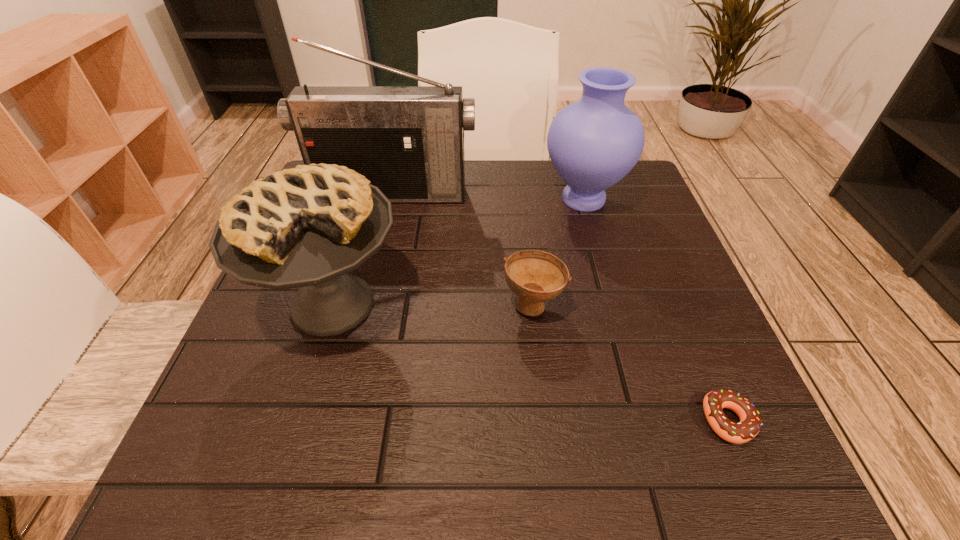
What are the coordinates of `object located in the near right corner section of the desktop` in the screenshot? It's located at (750, 423).

This screenshot has height=540, width=960. In the image, there is a desktop. What are the coordinates of `vacant space at the left edge` in the screenshot? It's located at (290, 420).

In the image, there is a desktop. Where is `vacant space at the right edge`? vacant space at the right edge is located at coordinates (651, 308).

In the image, there is a desktop. Find the location of `vacant space at the near right corner`. vacant space at the near right corner is located at coordinates (708, 463).

Image resolution: width=960 pixels, height=540 pixels. Identify the location of free space that is in between the doughnut and the vase. (656, 309).

This screenshot has width=960, height=540. In order to click on vacant point located between the soup bowl and the pie in this screenshot , I will do `click(433, 304)`.

I want to click on free space between the nearest object and the tallest object, so click(561, 307).

Identify the location of vacant space that is in between the fourth tallest object and the doughnut. This screenshot has width=960, height=540. (631, 362).

Locate an element on the screen. Image resolution: width=960 pixels, height=540 pixels. vacant area that lies between the radio receiver and the vase is located at coordinates (489, 196).

Locate an element on the screen. The width and height of the screenshot is (960, 540). vacant region between the second shortest object and the nearest object is located at coordinates (631, 362).